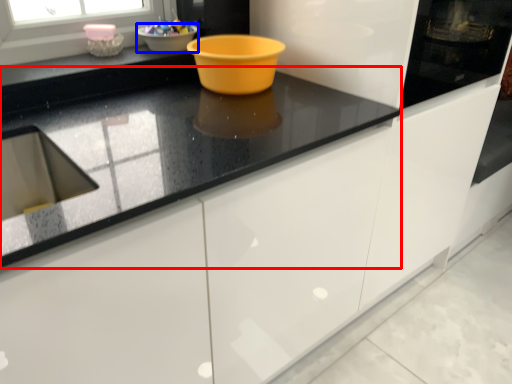
Question: Which of the following is the farthest to the observer, countertop (highlighted by a red box) or basin (highlighted by a blue box)?

Choices:
 (A) countertop
 (B) basin

Answer: (B)